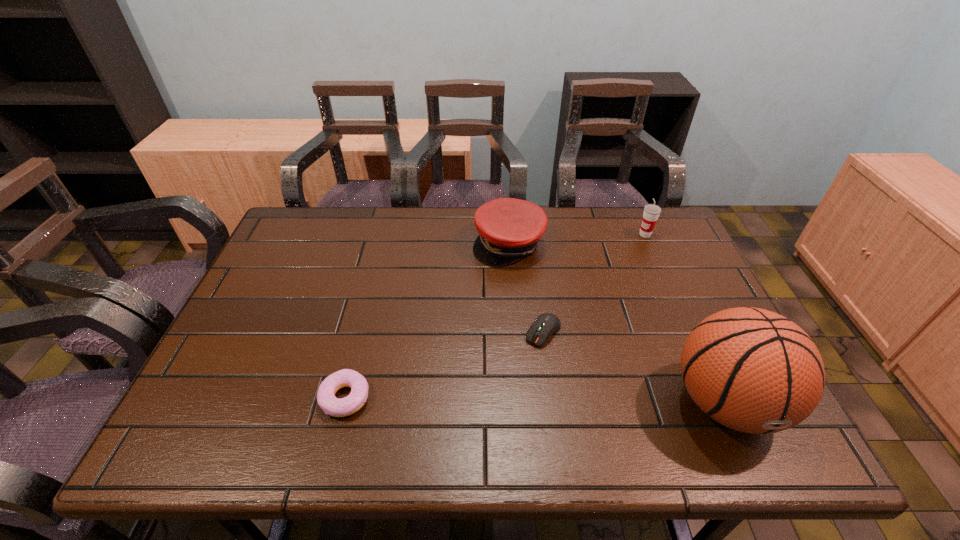
You are a GUI agent. You are given a task and a screenshot of the screen. Output one action in this format:
    pyautogui.click(x=<x>, y=<y>)
    Task: Click on the vacant space on the desktop that is between the leftmost object and the tallest object and is positioned on the button of the computer equipment
    This screenshot has height=540, width=960.
    Given the screenshot: What is the action you would take?
    pyautogui.click(x=489, y=400)

This screenshot has height=540, width=960. Identify the location of vacant space on the desktop that is between the leftmost object and the basketball and is positioned on the front-facing side of the cap. point(540,400).

What are the coordinates of `free spot on the desktop that is between the leftmost object and the basketball and is positioned on the side of the cup with the logo` in the screenshot? It's located at (500, 400).